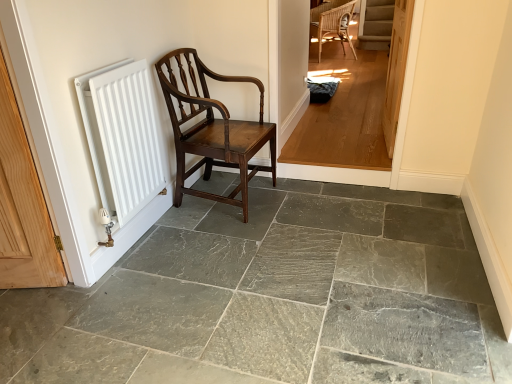
Image resolution: width=512 pixels, height=384 pixels. I want to click on free space in front of polished dark wood chair at left, so click(x=236, y=241).